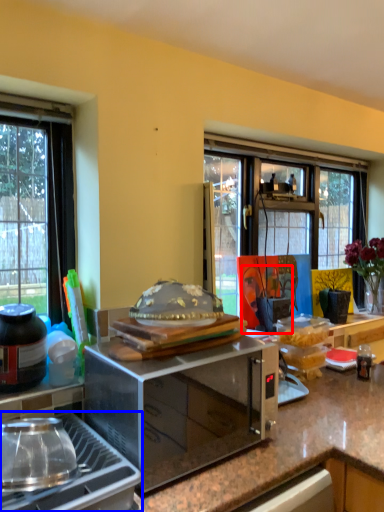
Question: Among these objects, which one is nearest to the camera, person (highlighted by a red box) or gas stove (highlighted by a blue box)?

Choices:
 (A) person
 (B) gas stove

Answer: (B)